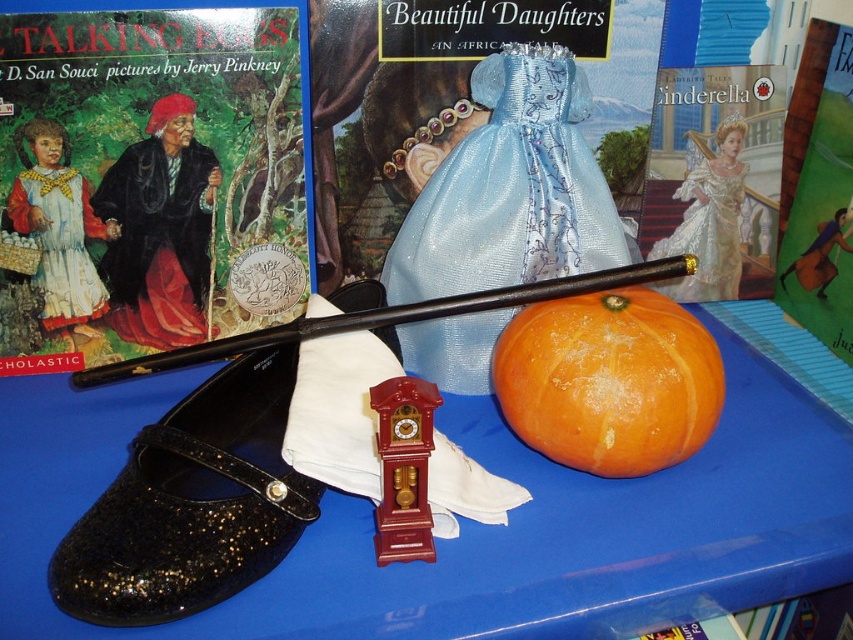
Question: Can you confirm if matte black book at left is bigger than black glitter shoe at lower left?

Choices:
 (A) no
 (B) yes

Answer: (B)

Question: From the image, what is the correct spatial relationship of black glitter shoe at lower left in relation to silky blue dress at center?

Choices:
 (A) left
 (B) right

Answer: (A)

Question: Among these points, which one is farthest from the camera?

Choices:
 (A) (451, 380)
 (B) (718, 157)
 (C) (764, 413)
 (D) (213, 419)

Answer: (B)

Question: Which of the following is the farthest from the observer?

Choices:
 (A) (717, 246)
 (B) (111, 12)
 (C) (325, 595)

Answer: (A)

Question: Does black glitter shoe at lower left have a smaller size compared to matte blue dress at center?

Choices:
 (A) no
 (B) yes

Answer: (A)

Question: Estimate the real-world distances between objects in this image. Which object is closer to the matte black book at left?

Choices:
 (A) shiny blue dress at center
 (B) matte yellow fabric doll at left
 (C) black glitter shoe at lower left
 (D) blue glossy table at center

Answer: (B)